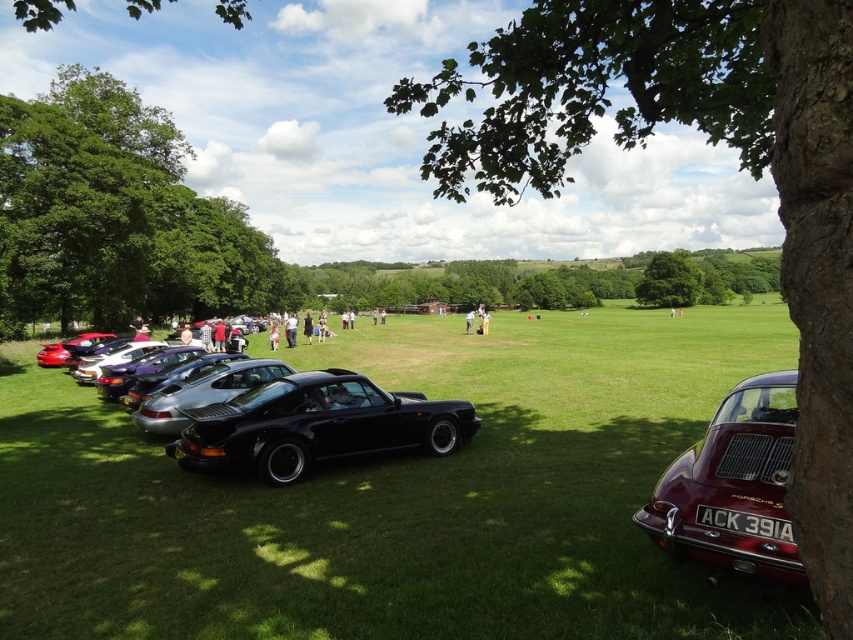
Is green grass at center shorter than green leafy tree at upper right?

Yes.

Who is more distant from viewer, (315, 474) or (582, 26)?

Positioned behind is point (315, 474).

Where is `green grass at center`? The height and width of the screenshot is (640, 853). green grass at center is located at coordinates (398, 497).

Between green leafy tree at center and dark blue dress at center, which one has less height?

With less height is dark blue dress at center.

Can you confirm if green leafy tree at center is thinner than dark blue dress at center?

No.

Locate an element on the screen. The width and height of the screenshot is (853, 640). green leafy tree at center is located at coordinates (467, 284).

Where is `green leafy tree at center`? This screenshot has height=640, width=853. green leafy tree at center is located at coordinates (467, 284).

Which is more to the left, green leafy tree at upper right or black glossy car at center?

Positioned to the left is black glossy car at center.

Where is `green leafy tree at upper right`? This screenshot has width=853, height=640. green leafy tree at upper right is located at coordinates (709, 141).